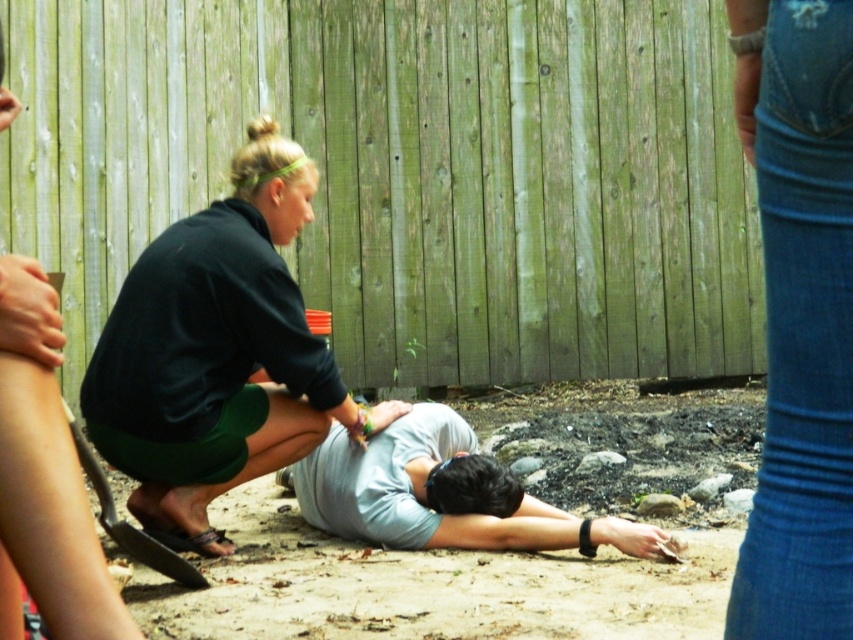
Question: Is green wood fence at upper center above dark green fabric skirt at center?

Choices:
 (A) no
 (B) yes

Answer: (B)

Question: Which point is closer to the camera?

Choices:
 (A) (601, 372)
 (B) (405, 536)
 (C) (827, 321)
 (D) (35, 554)

Answer: (D)

Question: Which object is closer to the camera taking this photo?

Choices:
 (A) gray matte shirt at center
 (B) dark green fabric skirt at center
 (C) green wood fence at upper center
 (D) denim jeans at lower right

Answer: (D)

Question: Can you confirm if dark green fabric skirt at center is wider than dark green fabric shorts at lower left?

Choices:
 (A) yes
 (B) no

Answer: (A)

Question: Does green wood fence at upper center have a larger size compared to dark green fabric shorts at lower left?

Choices:
 (A) no
 (B) yes

Answer: (B)

Question: Among these points, which one is farthest from the camera?

Choices:
 (A) (521, 496)
 (B) (291, 292)

Answer: (A)